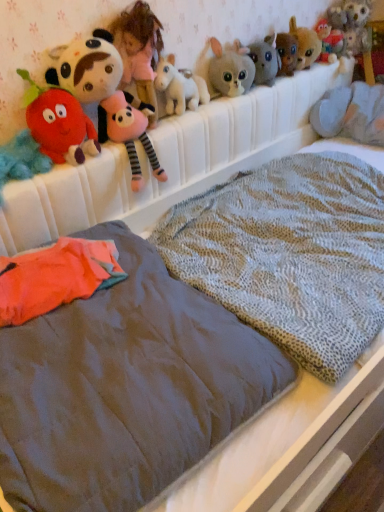
Question: Considering the relative positions of fluffy beige plush at upper center, which is the fourth toy in right-to-left order, and fluffy gray rabbit at upper center, positioned as the third toy in right-to-left order, in the image provided, is fluffy beige plush at upper center, which is the fourth toy in right-to-left order, to the right of fluffy gray rabbit at upper center, positioned as the third toy in right-to-left order, from the viewer's perspective?

Choices:
 (A) yes
 (B) no

Answer: (B)

Question: Is fluffy beige plush at upper center, which is the fourth toy in right-to-left order, further to the viewer compared to fluffy gray rabbit at upper center, acting as the fifth toy starting from the left?

Choices:
 (A) no
 (B) yes

Answer: (A)

Question: Can you confirm if fluffy beige plush at upper center, which is the fourth toy in right-to-left order, is thinner than fluffy gray rabbit at upper center, acting as the fifth toy starting from the left?

Choices:
 (A) yes
 (B) no

Answer: (B)

Question: Is fluffy beige plush at upper center, which is the fourth toy in right-to-left order, taller than fluffy gray rabbit at upper center, positioned as the third toy in right-to-left order?

Choices:
 (A) yes
 (B) no

Answer: (B)

Question: Does fluffy beige plush at upper center, marked as the 4th toy in a left-to-right arrangement, come in front of fluffy gray rabbit at upper center, positioned as the third toy in right-to-left order?

Choices:
 (A) yes
 (B) no

Answer: (A)

Question: Would you say fluffy beige plush at upper center, which is the fourth toy in right-to-left order, contains fluffy gray rabbit at upper center, acting as the fifth toy starting from the left?

Choices:
 (A) yes
 (B) no

Answer: (B)

Question: From the image's perspective, would you say fluffy gray rabbit at upper center, positioned as the third toy in right-to-left order, is positioned over soft pink plush doll at upper center?

Choices:
 (A) yes
 (B) no

Answer: (A)

Question: From a real-world perspective, is fluffy gray rabbit at upper center, acting as the fifth toy starting from the left, physically above soft pink plush doll at upper center?

Choices:
 (A) no
 (B) yes

Answer: (A)

Question: Is fluffy gray rabbit at upper center, acting as the fifth toy starting from the left, next to soft pink plush doll at upper center?

Choices:
 (A) yes
 (B) no

Answer: (B)

Question: Is fluffy gray rabbit at upper center, positioned as the third toy in right-to-left order, not near soft pink plush doll at upper center?

Choices:
 (A) no
 (B) yes

Answer: (A)

Question: Is fluffy gray rabbit at upper center, positioned as the third toy in right-to-left order, shorter than soft pink plush doll at upper center?

Choices:
 (A) no
 (B) yes

Answer: (B)

Question: Is fluffy gray rabbit at upper center, acting as the fifth toy starting from the left, behind soft pink plush doll at upper center?

Choices:
 (A) yes
 (B) no

Answer: (A)

Question: From a real-world perspective, is textured gray blanket at center beneath fluffy plush strawberry at left, acting as the 2th toy starting from the left?

Choices:
 (A) yes
 (B) no

Answer: (A)